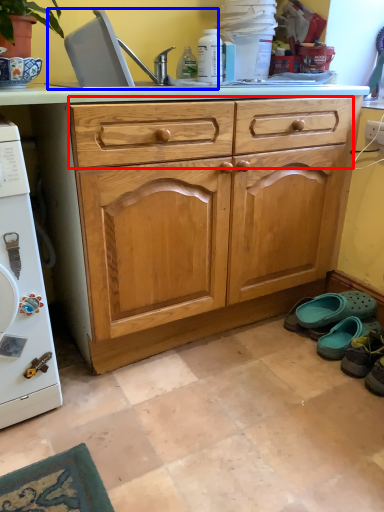
Question: Which of the following is the closest to the observer, drawer (highlighted by a red box) or sink (highlighted by a blue box)?

Choices:
 (A) drawer
 (B) sink

Answer: (A)